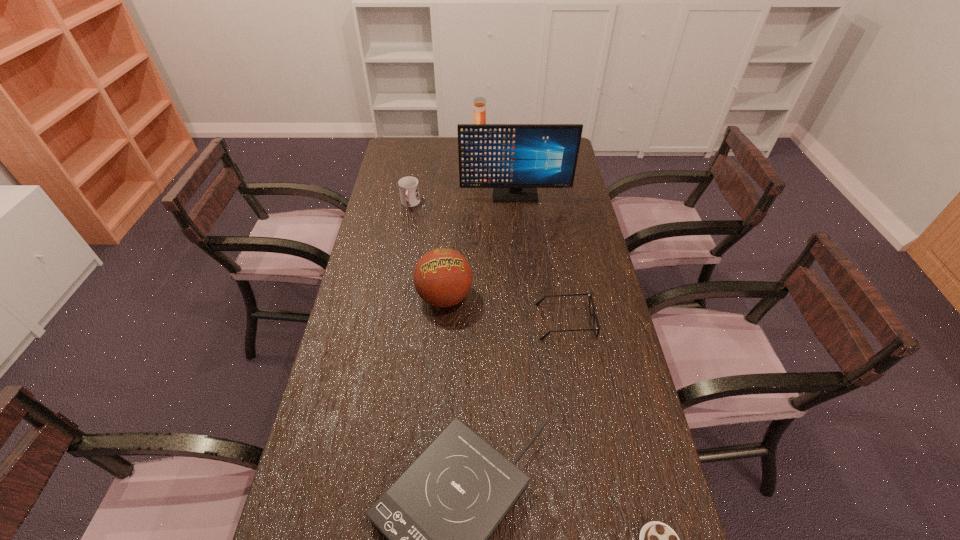
Locate an element on the screen. The width and height of the screenshot is (960, 540). computer monitor is located at coordinates (514, 159).

The height and width of the screenshot is (540, 960). I want to click on the sixth shortest object, so click(479, 102).

The width and height of the screenshot is (960, 540). Find the location of `the farthest object`. the farthest object is located at coordinates (479, 102).

Where is `the third tallest object`? Image resolution: width=960 pixels, height=540 pixels. the third tallest object is located at coordinates (442, 277).

Find the location of `cup`. cup is located at coordinates (408, 186).

The height and width of the screenshot is (540, 960). I want to click on the third shortest object, so click(x=593, y=315).

Image resolution: width=960 pixels, height=540 pixels. I want to click on vacant space located on the screen side of the computer monitor, so click(x=518, y=231).

Identify the location of vacant area located on the front-facing side of the sixth shortest object. (561, 157).

The image size is (960, 540). In order to click on vacant space positioned on the front of the basketball in this screenshot , I will do `click(438, 396)`.

Image resolution: width=960 pixels, height=540 pixels. I want to click on vacant point located on the side of the cup where the handle is located, so click(x=398, y=267).